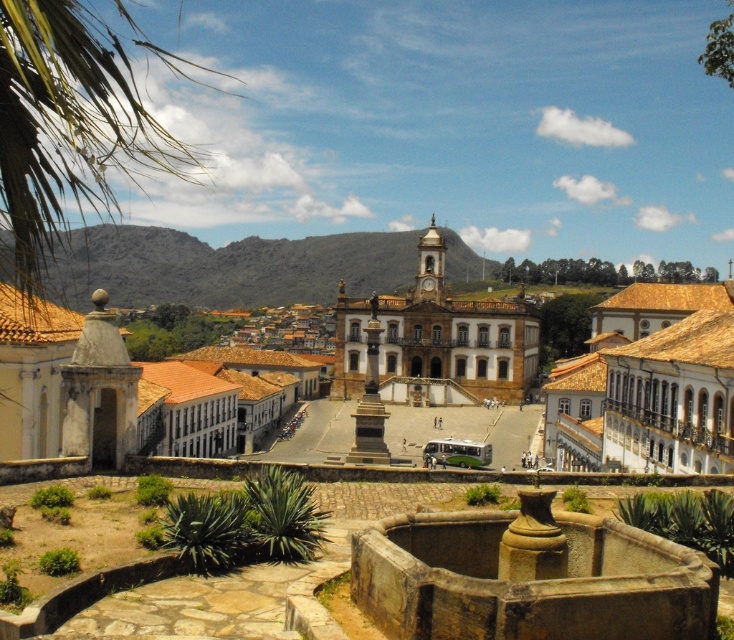
Question: Estimate the real-world distances between objects in this image. Which object is farther from the brown/white stone building at center-right?

Choices:
 (A) green leafy palm at upper left
 (B) brown stone building at center

Answer: (A)

Question: Can you confirm if white stone town at center is thinner than brown/white stone building at center-right?

Choices:
 (A) no
 (B) yes

Answer: (A)

Question: Is green leafy palm at upper left to the left of brown/white stone building at center-right from the viewer's perspective?

Choices:
 (A) no
 (B) yes

Answer: (B)

Question: Among these points, which one is farthest from the camera?

Choices:
 (A) pyautogui.click(x=40, y=435)
 (B) pyautogui.click(x=87, y=124)

Answer: (A)

Question: Which point appears closest to the camera in this image?

Choices:
 (A) (417, 362)
 (B) (473, 316)
 (C) (668, 349)

Answer: (C)

Question: Is white stone town at center above brown/white stone building at center-right?

Choices:
 (A) no
 (B) yes

Answer: (B)